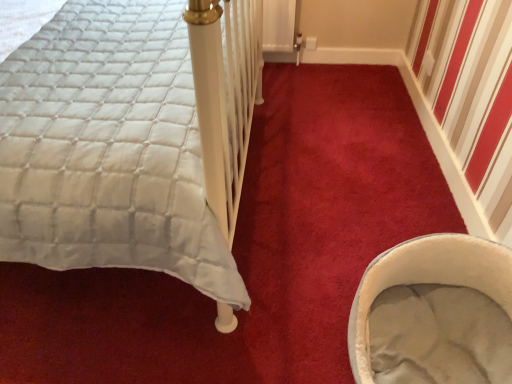
What is the approximate width of white quilted fabric at left?

white quilted fabric at left is 1.90 meters in width.

You are a GUI agent. You are given a task and a screenshot of the screen. Output one action in this format:
    pyautogui.click(x=<x>, y=<y>)
    Task: Click on the white quilted fabric at left
    
    Given the screenshot: What is the action you would take?
    (131, 147)

Describe the element at coordinates (131, 147) in the screenshot. I see `white quilted fabric at left` at that location.

This screenshot has width=512, height=384. I want to click on soft gray fabric baby carriage at lower right, so click(x=428, y=280).

What do you see at coordinates (428, 280) in the screenshot? The height and width of the screenshot is (384, 512). I see `soft gray fabric baby carriage at lower right` at bounding box center [428, 280].

In order to face soft gray fabric baby carriage at lower right, should I rotate leftwards or rightwards?

You should rotate right by 23.792 degrees.

Where is `white quilted fabric at left`? This screenshot has width=512, height=384. white quilted fabric at left is located at coordinates (131, 147).

Can you confirm if white quilted fabric at left is positioned to the left of soft gray fabric baby carriage at lower right?

Yes.

Is white quilted fabric at left in front of or behind soft gray fabric baby carriage at lower right in the image?

white quilted fabric at left is positioned closer to the viewer than soft gray fabric baby carriage at lower right.

Between point (12, 147) and point (433, 236), which one is positioned in front?

The point (12, 147) is more forward.

From the image's perspective, is white quilted fabric at left beneath soft gray fabric baby carriage at lower right?

No.

From a real-world perspective, between white quilted fabric at left and soft gray fabric baby carriage at lower right, who is vertically lower?

In real-world perspective, soft gray fabric baby carriage at lower right is lower.

Looking at their sizes, would you say white quilted fabric at left is wider or thinner than soft gray fabric baby carriage at lower right?

white quilted fabric at left is wider than soft gray fabric baby carriage at lower right.

From their relative heights in the image, would you say white quilted fabric at left is taller or shorter than soft gray fabric baby carriage at lower right?

white quilted fabric at left is taller than soft gray fabric baby carriage at lower right.

Between white quilted fabric at left and soft gray fabric baby carriage at lower right, which one has smaller size?

soft gray fabric baby carriage at lower right is smaller.

Is soft gray fabric baby carriage at lower right a part of white quilted fabric at left?

No, white quilted fabric at left does not contain soft gray fabric baby carriage at lower right.

Are white quilted fabric at left and soft gray fabric baby carriage at lower right far apart?

Actually, white quilted fabric at left and soft gray fabric baby carriage at lower right are a little close together.

Is white quilted fabric at left oriented away from soft gray fabric baby carriage at lower right?

No.

How far apart are white quilted fabric at left and soft gray fabric baby carriage at lower right?

They are 33.13 inches apart.

Find the location of a particular element. The height and width of the screenshot is (384, 512). baby carriage below the white quilted fabric at left (from the image's perspective) is located at coordinates (428, 280).

Between soft gray fabric baby carriage at lower right and white quilted fabric at left, which one appears on the left side from the viewer's perspective?

white quilted fabric at left is more to the left.

Considering the positions of objects soft gray fabric baby carriage at lower right and white quilted fabric at left in the image provided, who is behind, soft gray fabric baby carriage at lower right or white quilted fabric at left?

Positioned behind is soft gray fabric baby carriage at lower right.

Considering the positions of point (391, 252) and point (11, 116), is point (391, 252) closer or farther from the camera than point (11, 116)?

Clearly, point (391, 252) is more distant from the camera than point (11, 116).

From the image's perspective, is soft gray fabric baby carriage at lower right below white quilted fabric at left?

Indeed, from the image's perspective, soft gray fabric baby carriage at lower right is shown beneath white quilted fabric at left.

From a real-world perspective, between soft gray fabric baby carriage at lower right and white quilted fabric at left, who is vertically lower?

soft gray fabric baby carriage at lower right, from a real-world perspective.

Is soft gray fabric baby carriage at lower right thinner than white quilted fabric at left?

Correct, the width of soft gray fabric baby carriage at lower right is less than that of white quilted fabric at left.

Considering the sizes of soft gray fabric baby carriage at lower right and white quilted fabric at left in the image, is soft gray fabric baby carriage at lower right taller or shorter than white quilted fabric at left?

Considering their sizes, soft gray fabric baby carriage at lower right has less height than white quilted fabric at left.

Is soft gray fabric baby carriage at lower right bigger or smaller than white quilted fabric at left?

soft gray fabric baby carriage at lower right is smaller than white quilted fabric at left.

Do you think soft gray fabric baby carriage at lower right is within white quilted fabric at left, or outside of it?

The correct answer is: outside.

Based on the photo, is soft gray fabric baby carriage at lower right not near white quilted fabric at left?

No, soft gray fabric baby carriage at lower right is not far away from white quilted fabric at left.

Could you tell me if soft gray fabric baby carriage at lower right is facing white quilted fabric at left?

Yes, soft gray fabric baby carriage at lower right is aimed at white quilted fabric at left.

Image resolution: width=512 pixels, height=384 pixels. What are the coordinates of `bed lying on the left of soft gray fabric baby carriage at lower right` in the screenshot? It's located at (131, 147).

The width and height of the screenshot is (512, 384). I want to click on bed above the soft gray fabric baby carriage at lower right (from the image's perspective), so click(x=131, y=147).

This screenshot has width=512, height=384. Find the location of `bed on the left of soft gray fabric baby carriage at lower right`. bed on the left of soft gray fabric baby carriage at lower right is located at coordinates (131, 147).